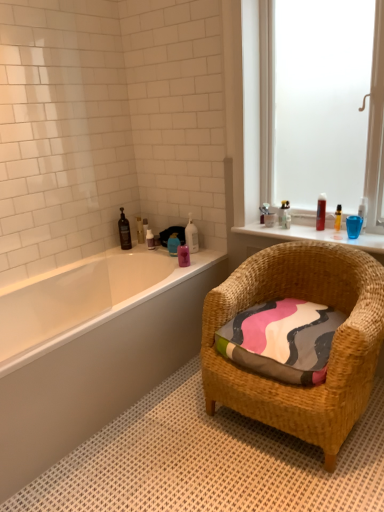
Image resolution: width=384 pixels, height=512 pixels. Find the location of `vacant area that lies to the right of shiny brown bottle at left, marked as the tenth toiletry in a right-to-left arrangement`. vacant area that lies to the right of shiny brown bottle at left, marked as the tenth toiletry in a right-to-left arrangement is located at coordinates (139, 248).